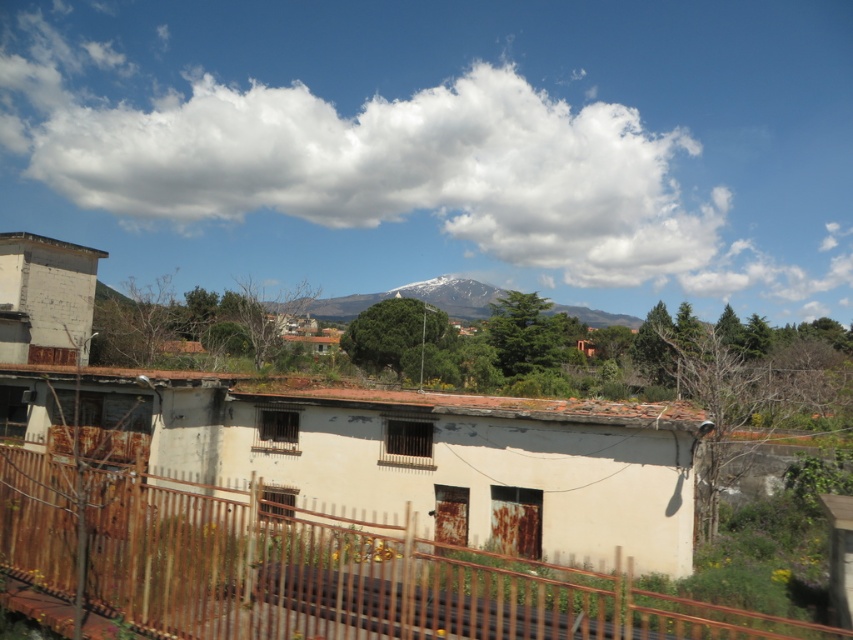
You are standing in front of the weathered building and want to take a photo of the white fluffy cloud at upper center. The camera you have can focus on objects up to 150 meters away. Will you be able to capture the cloud clearly?

The white fluffy cloud at upper center is 166.26 meters from the viewer, which is beyond the camera lens focusing range of 150 meters. Therefore, the cloud will not be in focus and the photo will be blurry.

You are a pilot flying a small airplane and notice the white fluffy cloud at upper center and the snowy white mountain at center in the distance. Which object is higher in the sky?

The white fluffy cloud at upper center is positioned over the snowy white mountain at center, so the cloud is higher in the sky.